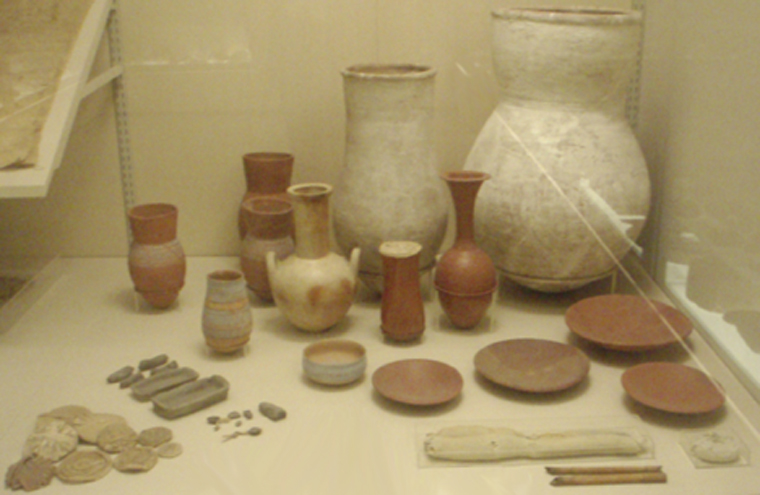
You are a GUI agent. You are given a task and a screenshot of the screen. Output one action in this format:
    pyautogui.click(x=<x>, y=<y>)
    Task: Click on the plates
    The width and height of the screenshot is (760, 495).
    Given the screenshot: What is the action you would take?
    pyautogui.click(x=429, y=385), pyautogui.click(x=533, y=349), pyautogui.click(x=613, y=313), pyautogui.click(x=676, y=391)